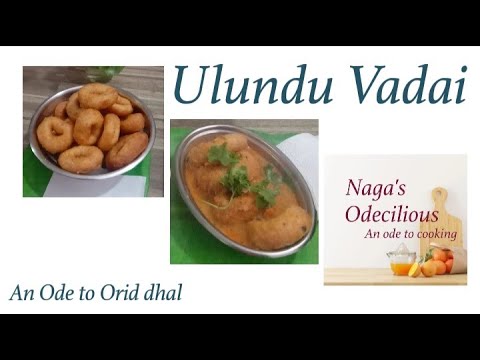
Locate an element on the screen. This screenshot has height=360, width=480. napkin is located at coordinates (125, 185).